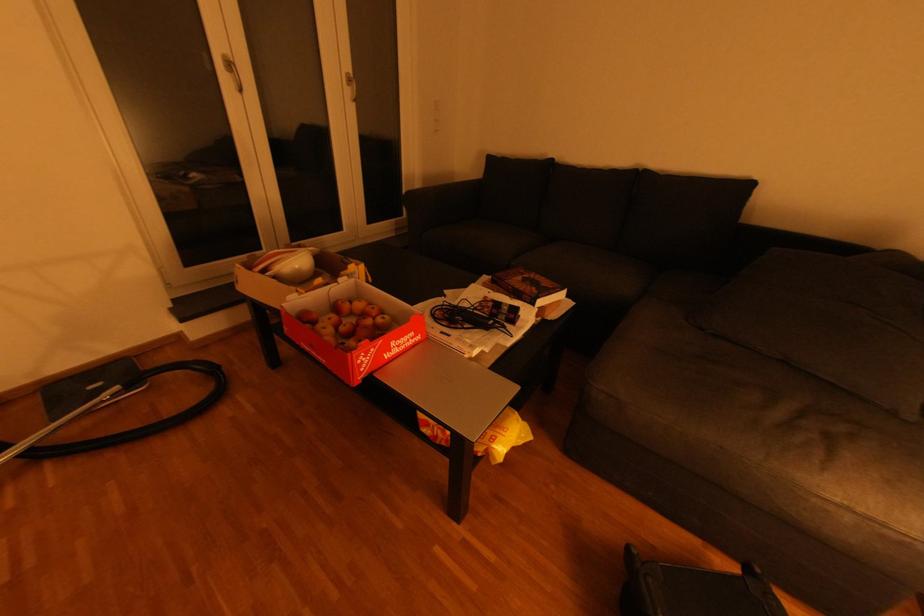
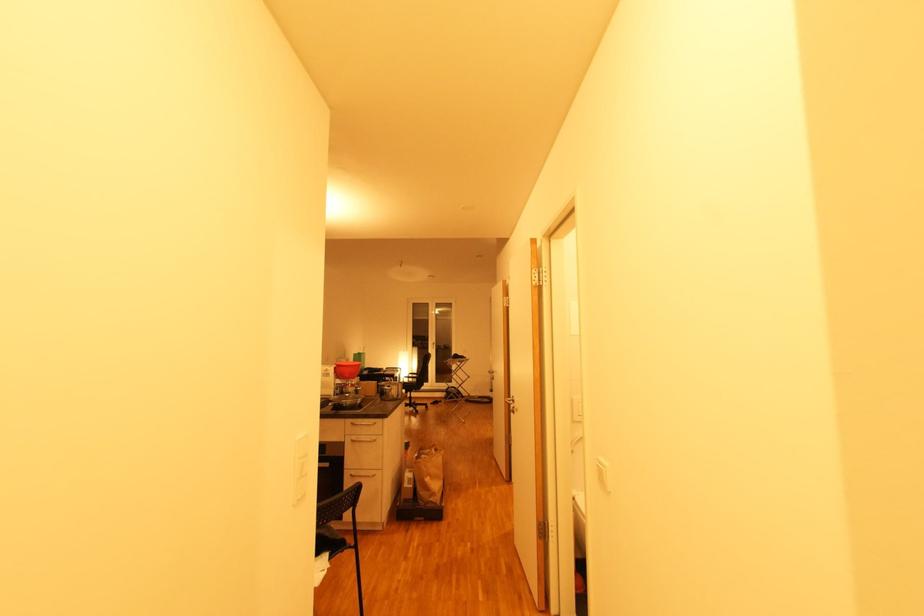
Question: I am providing you with two images of the same scene from different viewpoints. After the viewpoint changes to image2, which objects are now occluded?

Choices:
 (A) brown paper bag
 (B) sofa armrest
 (C) silver spray can
 (D) red plastic bowl

Answer: (B)